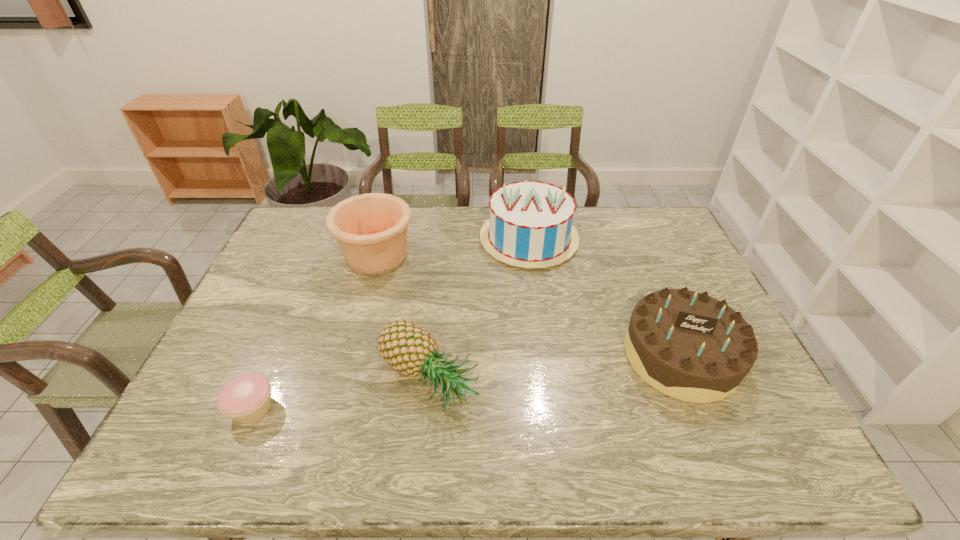
In order to click on free space at the far right corner of the desktop in this screenshot , I will do `click(661, 232)`.

This screenshot has width=960, height=540. I want to click on free space between the right birthday cake and the pineapple, so click(x=555, y=368).

Where is `unoccupied position between the pottery and the taller birthday cake`? unoccupied position between the pottery and the taller birthday cake is located at coordinates (453, 248).

The width and height of the screenshot is (960, 540). Identify the location of blank region between the left birthday cake and the pineapple. click(479, 309).

The width and height of the screenshot is (960, 540). Find the location of `vacant point located between the pottery and the left birthday cake`. vacant point located between the pottery and the left birthday cake is located at coordinates (453, 248).

You are a GUI agent. You are given a task and a screenshot of the screen. Output one action in this format:
    pyautogui.click(x=<x>, y=<y>)
    Task: Click on the unoccupied position between the cupcake and the pineapple
    
    Given the screenshot: What is the action you would take?
    pyautogui.click(x=341, y=394)

You are a GUI agent. You are given a task and a screenshot of the screen. Output one action in this format:
    pyautogui.click(x=<x>, y=<y>)
    Task: Click on the free space between the pineapple and the pottery
    This screenshot has width=960, height=540.
    Given the screenshot: What is the action you would take?
    pyautogui.click(x=403, y=319)

Where is `free spot between the cupcake and the pineapple`? free spot between the cupcake and the pineapple is located at coordinates (341, 394).

Locate an element on the screen. This screenshot has height=540, width=960. blank region between the shortest object and the pottery is located at coordinates (315, 332).

Locate an element on the screen. object that can be found as the third closest to the rightmost object is located at coordinates (371, 229).